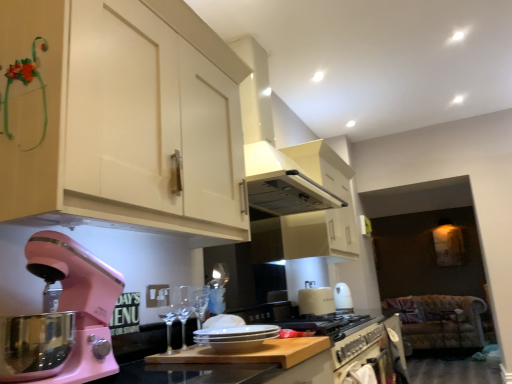
Question: Does smooth wooden cutting board at center come in front of clear glass wine glass at center, positioned as the first wine glass in front-to-back order?

Choices:
 (A) yes
 (B) no

Answer: (A)

Question: From the image's perspective, would you say smooth wooden cutting board at center is shown under clear glass wine glass at center, positioned as the first wine glass in front-to-back order?

Choices:
 (A) no
 (B) yes

Answer: (B)

Question: Does smooth wooden cutting board at center have a smaller size compared to clear glass wine glass at center, which is the second wine glass in back-to-front order?

Choices:
 (A) yes
 (B) no

Answer: (B)

Question: Is smooth wooden cutting board at center behind clear glass wine glass at center, which is the second wine glass in back-to-front order?

Choices:
 (A) no
 (B) yes

Answer: (A)

Question: Does smooth wooden cutting board at center appear on the left side of clear glass wine glass at center, which is the second wine glass in back-to-front order?

Choices:
 (A) yes
 (B) no

Answer: (B)

Question: From a real-world perspective, relative to clear glass wine glass at center, positioned as the first wine glass in front-to-back order, is smooth wooden cutting board at center vertically above or below?

Choices:
 (A) below
 (B) above

Answer: (A)

Question: Choose the correct answer: Is smooth wooden cutting board at center inside clear glass wine glass at center, which is the second wine glass in back-to-front order, or outside it?

Choices:
 (A) inside
 (B) outside

Answer: (B)

Question: From the image's perspective, relative to clear glass wine glass at center, positioned as the first wine glass in front-to-back order, is smooth wooden cutting board at center above or below?

Choices:
 (A) above
 (B) below

Answer: (B)

Question: Considering the positions of point (286, 359) and point (159, 314), is point (286, 359) closer or farther from the camera than point (159, 314)?

Choices:
 (A) closer
 (B) farther

Answer: (A)

Question: Looking at the image, does metallic silver oven at lower center seem bigger or smaller compared to velvet floral-patterned sofa at lower right?

Choices:
 (A) small
 (B) big

Answer: (A)

Question: Is metallic silver oven at lower center in front of or behind velvet floral-patterned sofa at lower right in the image?

Choices:
 (A) front
 (B) behind

Answer: (A)

Question: Looking at their shapes, would you say metallic silver oven at lower center is wider or thinner than velvet floral-patterned sofa at lower right?

Choices:
 (A) thin
 (B) wide

Answer: (A)

Question: Is point 361,350 closer or farther from the camera than point 456,301?

Choices:
 (A) farther
 (B) closer

Answer: (B)

Question: Considering the positions of metallic silver oven at lower center and clear glass wine glass at center, which is the second wine glass in back-to-front order, in the image, is metallic silver oven at lower center wider or thinner than clear glass wine glass at center, which is the second wine glass in back-to-front order,?

Choices:
 (A) thin
 (B) wide

Answer: (B)

Question: Is metallic silver oven at lower center inside the boundaries of clear glass wine glass at center, which is the second wine glass in back-to-front order, or outside?

Choices:
 (A) inside
 (B) outside

Answer: (B)